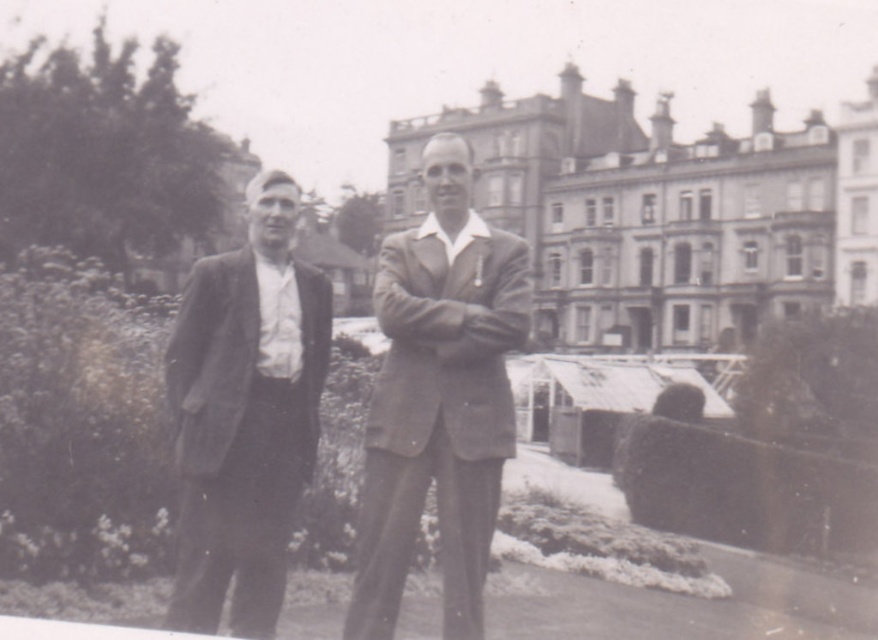
Question: Among these objects, which one is farthest from the camera?

Choices:
 (A) smooth woolen suit at left
 (B) smooth brown suit at center

Answer: (B)

Question: Among these objects, which one is farthest from the camera?

Choices:
 (A) smooth woolen suit at left
 (B) smooth brown suit at center

Answer: (B)

Question: Can you confirm if smooth brown suit at center is positioned to the right of smooth woolen suit at left?

Choices:
 (A) yes
 (B) no

Answer: (A)

Question: Is smooth brown suit at center further to the viewer compared to smooth woolen suit at left?

Choices:
 (A) no
 (B) yes

Answer: (B)

Question: Which point appears farthest from the camera in this image?

Choices:
 (A) (407, 550)
 (B) (229, 625)

Answer: (A)

Question: Can you confirm if smooth brown suit at center is positioned to the right of smooth woolen suit at left?

Choices:
 (A) yes
 (B) no

Answer: (A)